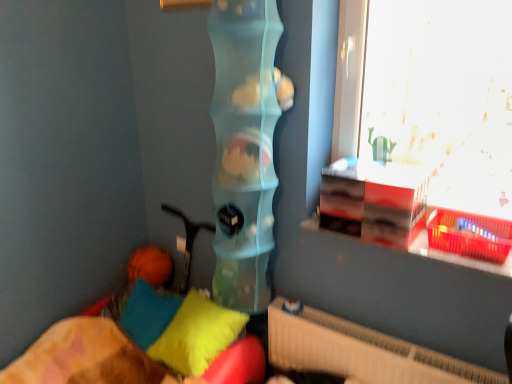
Image resolution: width=512 pixels, height=384 pixels. I want to click on free space above white textured radiator at lower right (from a real-world perspective), so click(x=375, y=340).